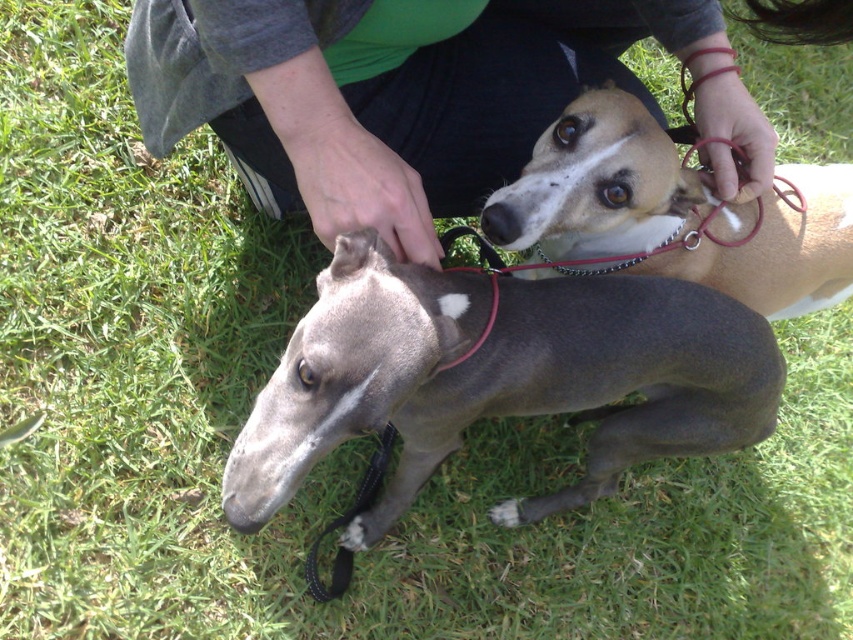
You are trying to decide which item is wider between the green fabric shirt at upper center and the brown smooth dog at center. Based on the scene, can you determine which one is wider?

The green fabric shirt at upper center might be wider than brown smooth dog at center according to the description.

You are a photographer trying to capture the smooth gray dog at center in the image. According to the coordinates provided, where should you focus your camera to ensure the dog is centered in your shot?

You should focus your camera at the coordinates point (497, 378) to center the smooth gray dog at center in your shot.

You are a photographer trying to capture the two Italian Greyhounds in the image. The coordinates provided indicate a specific point of interest. Which dog is located at the coordinates point (497, 378)?

The point (497, 378) corresponds to the smooth gray dog at center.